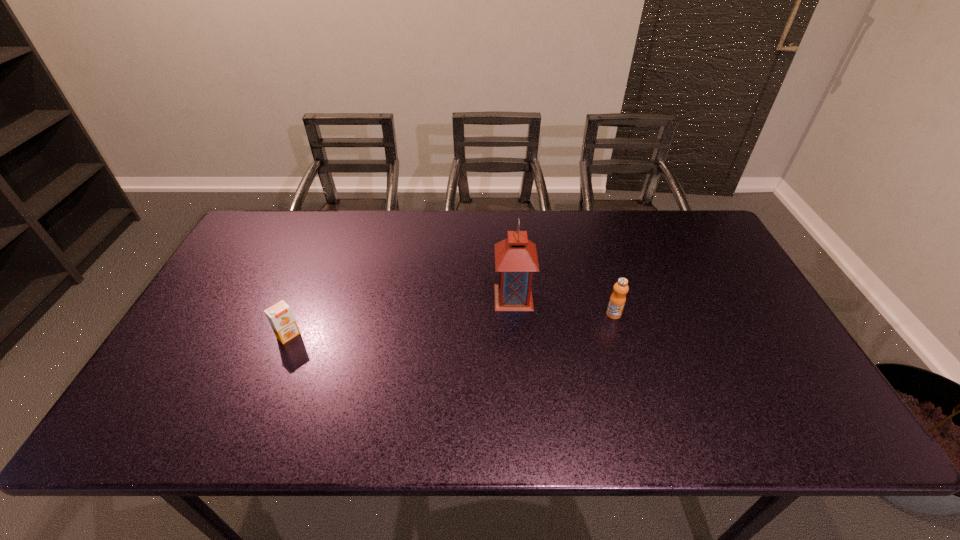
The width and height of the screenshot is (960, 540). I want to click on the tallest object, so click(516, 259).

Identify the location of the second object from right to left. Image resolution: width=960 pixels, height=540 pixels. (516, 259).

The image size is (960, 540). Identify the location of the rightmost object. (617, 300).

Locate an element on the screen. Image resolution: width=960 pixels, height=540 pixels. the second tallest object is located at coordinates (617, 300).

Identify the location of the nearest object. (280, 316).

This screenshot has height=540, width=960. I want to click on the nearer orange juice, so click(x=280, y=316).

Locate an element on the screen. The height and width of the screenshot is (540, 960). vacant position located 0.100m on the right of the second object from left to right is located at coordinates (568, 297).

This screenshot has height=540, width=960. What are the coordinates of `free space located on the front label of the taller orange juice` in the screenshot? It's located at (637, 394).

This screenshot has width=960, height=540. Identify the location of vacant space situated 0.200m on the back of the nearer orange juice. (313, 275).

The image size is (960, 540). I want to click on free space at the far edge of the desktop, so click(x=415, y=222).